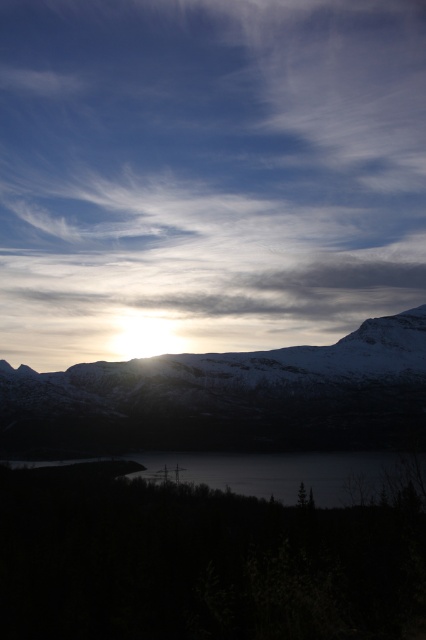
You are an airplane pilot flying over the landscape. You notice the white fluffy cloud at upper center and the dark glassy water at center. Which object is higher in the sky?

The white fluffy cloud at upper center is taller than the dark glassy water at center, so the white fluffy cloud at upper center is higher in the sky.

You are an airplane pilot flying at a height of 10,000 feet. You notice the white fluffy cloud at upper center and the snowy rock mountain range at center in the distance. Which object is higher in elevation compared to the other?

The white fluffy cloud at upper center is much taller than the snowy rock mountain range at center, so the white fluffy cloud at upper center is higher in elevation.

You are an artist planning to paint the landscape. You want to ensure the snowy rock mountain range at center and dark glassy water at center are proportionally accurate. Which object should you make larger in your painting?

The snowy rock mountain range at center should be made larger than the dark glassy water at center because it is described as larger in size according to the scene description.